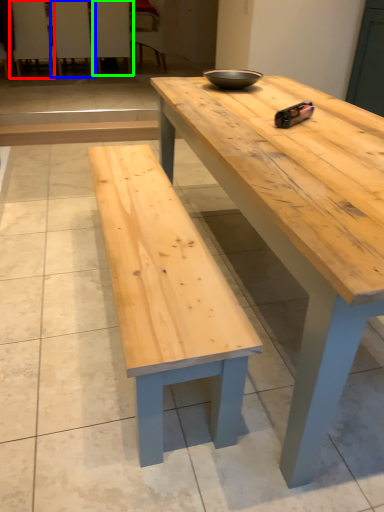
Question: Considering the real-world distances, which object is farthest from chair (highlighted by a red box)? chair (highlighted by a blue box) or chair (highlighted by a green box)?

Choices:
 (A) chair
 (B) chair

Answer: (B)